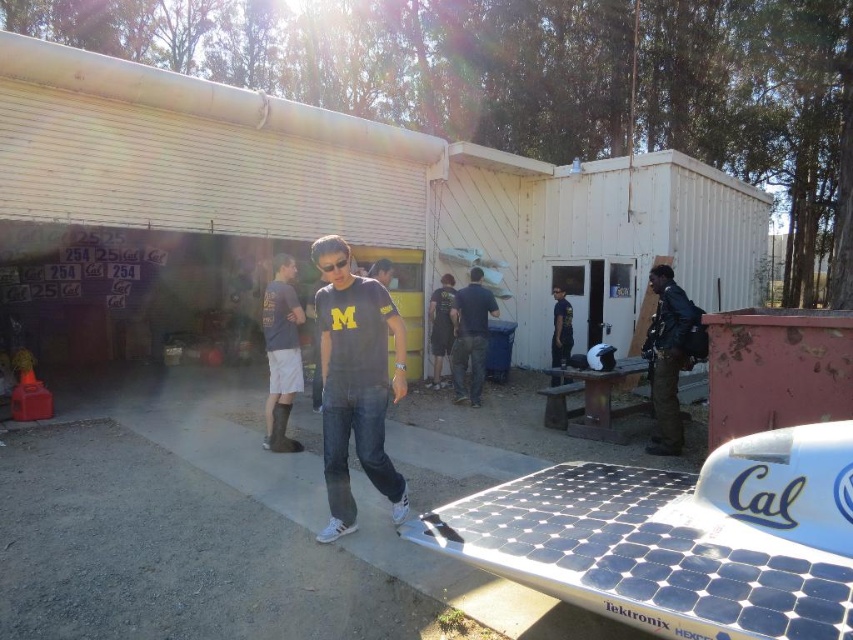
Question: Observing the image, what is the correct spatial positioning of dark blue jeans at center in reference to dark blue t-shirt at center?

Choices:
 (A) below
 (B) above

Answer: (A)

Question: Based on their relative distances, which object is farther from the dark blue t-shirt at center?

Choices:
 (A) dark blue shirt at center
 (B) dark blue jeans at center
 (C) black leather jacket at right

Answer: (B)

Question: Can you confirm if dark blue jersey at center is positioned above dark blue t-shirt at center?

Choices:
 (A) no
 (B) yes

Answer: (A)

Question: Estimate the real-world distances between objects in this image. Which object is farther from the dark blue jersey at center?

Choices:
 (A) black leather jacket at right
 (B) dark blue shirt at center
 (C) dark blue jeans at center

Answer: (B)

Question: Is dark blue jeans at center below dark blue shirt at center?

Choices:
 (A) no
 (B) yes

Answer: (B)

Question: Which object is closer to the camera taking this photo?

Choices:
 (A) black leather jacket at right
 (B) dark blue jersey at center
 (C) dark blue jeans at center
 (D) dark blue t-shirt at center

Answer: (B)